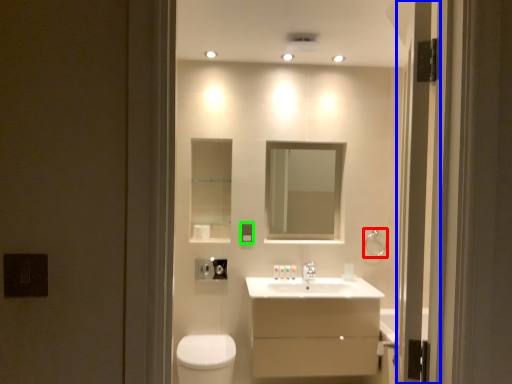
Question: Based on their relative distances, which object is farther from towel bar (highlighted by a red box)? Choose from screen door (highlighted by a blue box) and electric outlet (highlighted by a green box).

Choices:
 (A) screen door
 (B) electric outlet

Answer: (A)